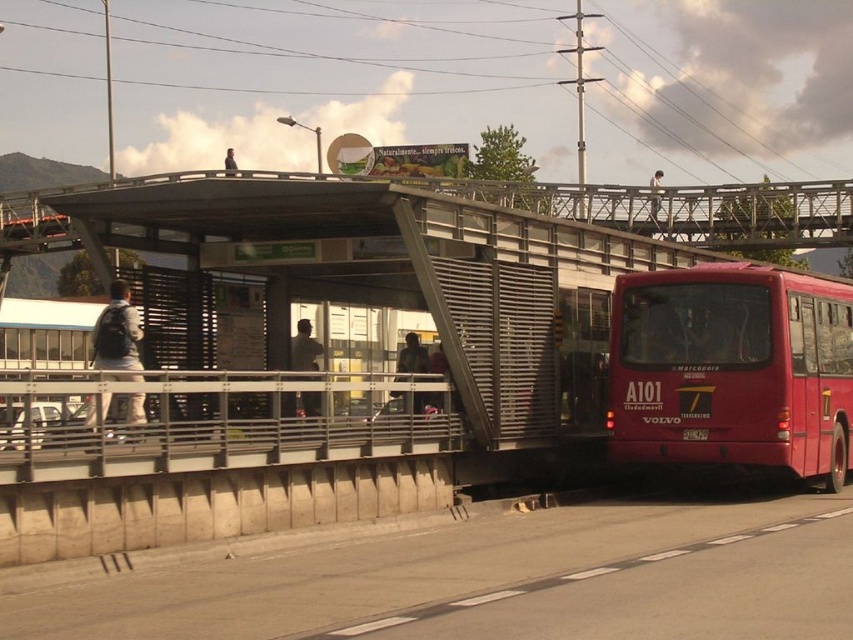
You are standing at the bus station and see the red matte bus at right and the white fabric backpack at left. Which object is positioned more to the east if the bus station faces north?

The red matte bus at right is positioned to the right of the white fabric backpack at left. Since the bus station faces north, the right side would be east. Therefore, the red matte bus at right is more to the east.

You are a delivery person who needs to load a package onto the red matte bus at right. The package is as wide as the white fabric backpack at left. Will the package fit inside the bus?

The red matte bus at right is wider than the white fabric backpack at left, so the package, being the same width as the backpack, will fit inside the bus.

Consider the image. You are a passenger at the bus station and notice two people wearing dark gray jackets. The first dark gray jacket at center belongs to a person standing near the bus, while the second dark gray jacket at upper center is on someone walking towards the entrance. Which jacket appears narrower when viewed from your position?

The dark gray jacket at center appears narrower because it is thinner than the dark gray jacket at upper center.